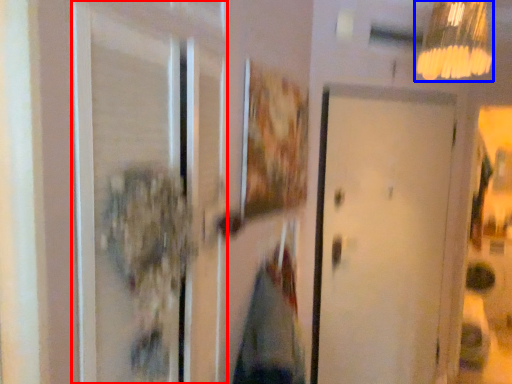
Question: Which of the following is the closest to the observer, screen door (highlighted by a red box) or lamp (highlighted by a blue box)?

Choices:
 (A) screen door
 (B) lamp

Answer: (A)